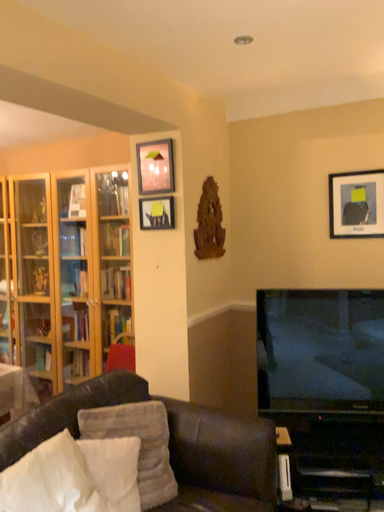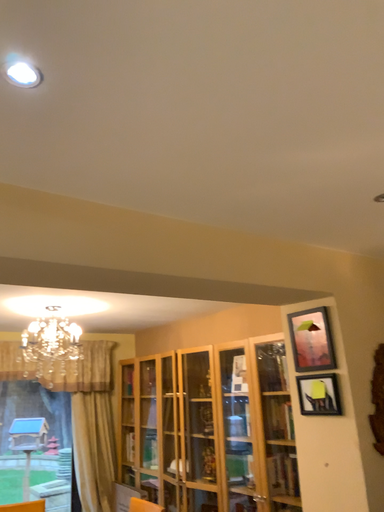
Question: Which way did the camera rotate in the video?

Choices:
 (A) rotated right
 (B) rotated left

Answer: (B)